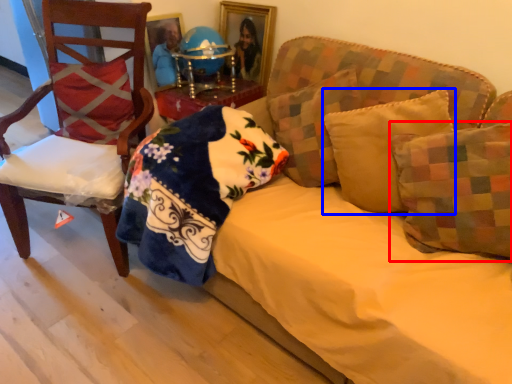
Question: Which object is further to the camera taking this photo, pillow (highlighted by a red box) or pillow (highlighted by a blue box)?

Choices:
 (A) pillow
 (B) pillow

Answer: (B)